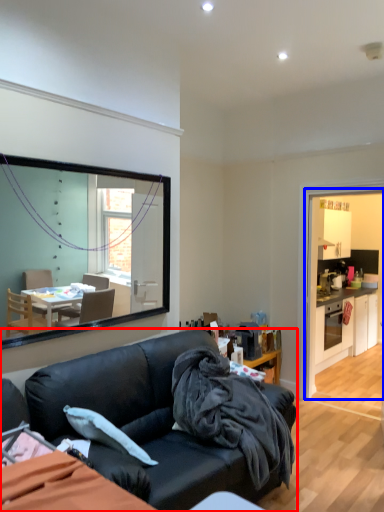
Question: Which object is further to the camera taking this photo, studio couch (highlighted by a red box) or dresser (highlighted by a blue box)?

Choices:
 (A) studio couch
 (B) dresser

Answer: (B)